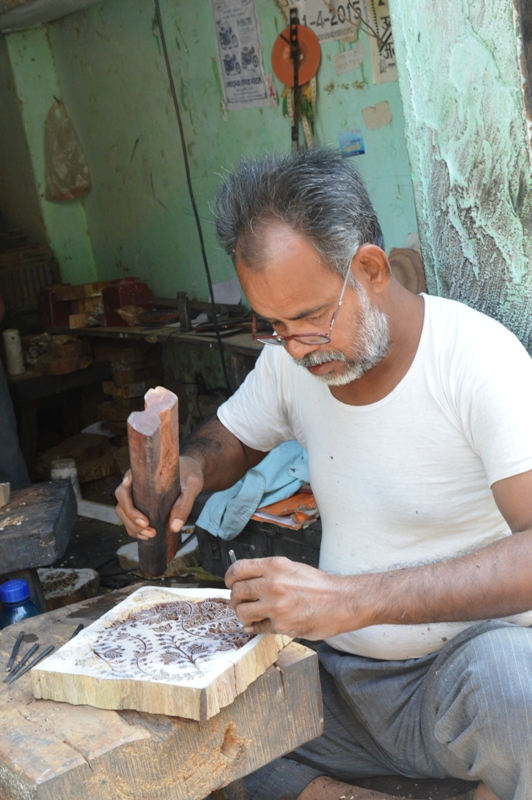
Image resolution: width=532 pixels, height=800 pixels. Find the location of `cabinet`. cabinet is located at coordinates (39, 542).